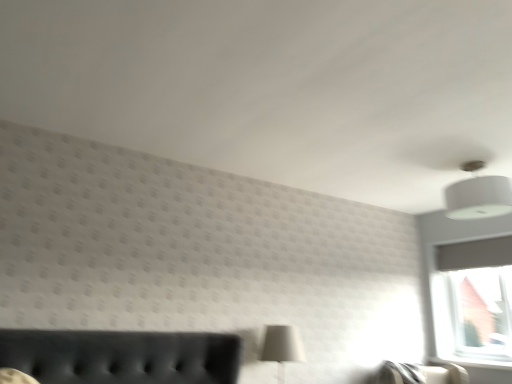
Question: Considering the relative sizes of white fabric lampshade at upper right and white matte table lamp at lower center in the image provided, is white fabric lampshade at upper right taller than white matte table lamp at lower center?

Choices:
 (A) no
 (B) yes

Answer: (A)

Question: Is white fabric lampshade at upper right oriented away from white matte table lamp at lower center?

Choices:
 (A) yes
 (B) no

Answer: (B)

Question: From the image's perspective, is white fabric lampshade at upper right located above white matte table lamp at lower center?

Choices:
 (A) no
 (B) yes

Answer: (B)

Question: Can you confirm if white fabric lampshade at upper right is positioned to the left of white matte table lamp at lower center?

Choices:
 (A) yes
 (B) no

Answer: (B)

Question: From a real-world perspective, is white fabric lampshade at upper right positioned over white matte table lamp at lower center based on gravity?

Choices:
 (A) no
 (B) yes

Answer: (B)

Question: In terms of width, does white glossy window sill at lower right look wider or thinner when compared to white fabric lampshade at upper right?

Choices:
 (A) thin
 (B) wide

Answer: (A)

Question: Does point (437, 362) appear closer or farther from the camera than point (452, 185)?

Choices:
 (A) closer
 (B) farther

Answer: (B)

Question: From the image's perspective, is white glossy window sill at lower right above or below white fabric lampshade at upper right?

Choices:
 (A) above
 (B) below

Answer: (B)

Question: Considering the positions of white glossy window sill at lower right and white fabric lampshade at upper right in the image, is white glossy window sill at lower right taller or shorter than white fabric lampshade at upper right?

Choices:
 (A) short
 (B) tall

Answer: (A)

Question: From the image's perspective, is white matte table lamp at lower center above or below white glossy window sill at lower right?

Choices:
 (A) below
 (B) above

Answer: (B)

Question: Visually, is white matte table lamp at lower center positioned to the left or to the right of white glossy window sill at lower right?

Choices:
 (A) right
 (B) left

Answer: (B)

Question: In the image, is white matte table lamp at lower center positioned in front of or behind white glossy window sill at lower right?

Choices:
 (A) behind
 (B) front

Answer: (B)

Question: Is white matte table lamp at lower center bigger or smaller than white glossy window sill at lower right?

Choices:
 (A) small
 (B) big

Answer: (B)

Question: In the image, is white glossy window sill at lower right on the left side or the right side of white matte table lamp at lower center?

Choices:
 (A) right
 (B) left

Answer: (A)

Question: In terms of width, does white glossy window sill at lower right look wider or thinner when compared to white matte table lamp at lower center?

Choices:
 (A) wide
 (B) thin

Answer: (B)